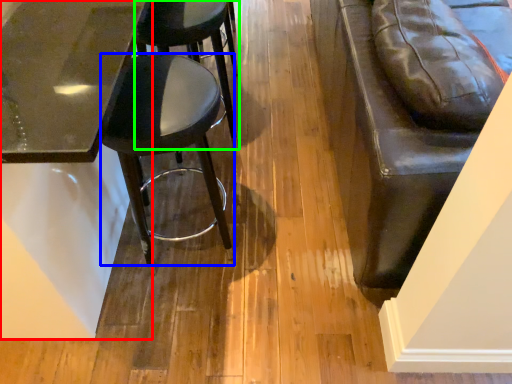
Question: Estimate the real-world distances between objects in this image. Which object is closer to table (highlighted by a red box), stool (highlighted by a blue box) or stool (highlighted by a green box)?

Choices:
 (A) stool
 (B) stool

Answer: (A)